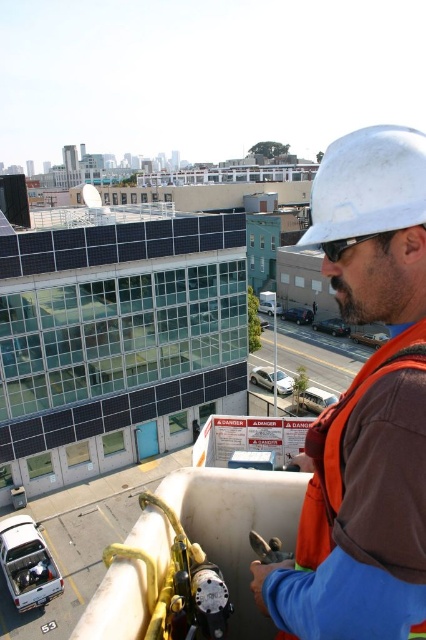
Question: Which object appears farthest from the camera in this image?

Choices:
 (A) white matte hard hat at upper right
 (B) white hard hat at upper right

Answer: (A)

Question: Which object appears farthest from the camera in this image?

Choices:
 (A) white hard hat at upper right
 (B) white matte hard hat at upper right

Answer: (B)

Question: Can you confirm if white hard hat at upper right is smaller than white matte hard hat at upper right?

Choices:
 (A) yes
 (B) no

Answer: (B)

Question: Which of the following is the closest to the observer?

Choices:
 (A) white hard hat at upper right
 (B) white matte hard hat at upper right

Answer: (A)

Question: Can you confirm if white hard hat at upper right is positioned to the left of white matte hard hat at upper right?

Choices:
 (A) no
 (B) yes

Answer: (B)

Question: Is white hard hat at upper right to the left of white matte hard hat at upper right from the viewer's perspective?

Choices:
 (A) yes
 (B) no

Answer: (A)